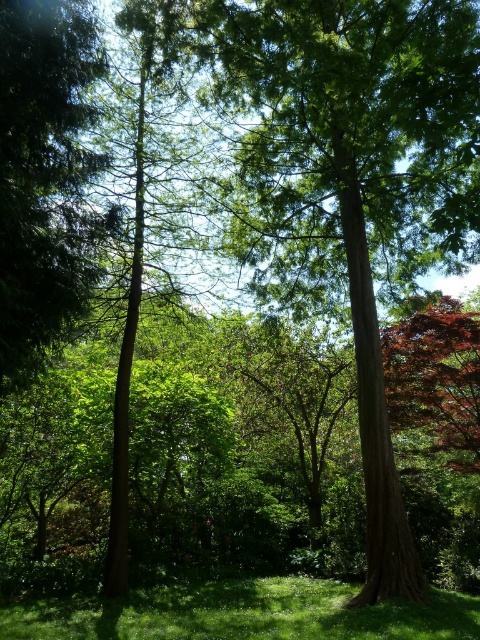
Who is more distant from viewer, (20, 52) or (315, 612)?

The point (315, 612) is behind.

In the scene shown: Between green leafy tree at left and green grassy at lower center, which one appears on the left side from the viewer's perspective?

green leafy tree at left is more to the left.

Is point (0, 124) closer to camera compared to point (216, 595)?

Yes, point (0, 124) is closer to viewer.

The image size is (480, 640). Find the location of `green leafy tree at left`. green leafy tree at left is located at coordinates (43, 172).